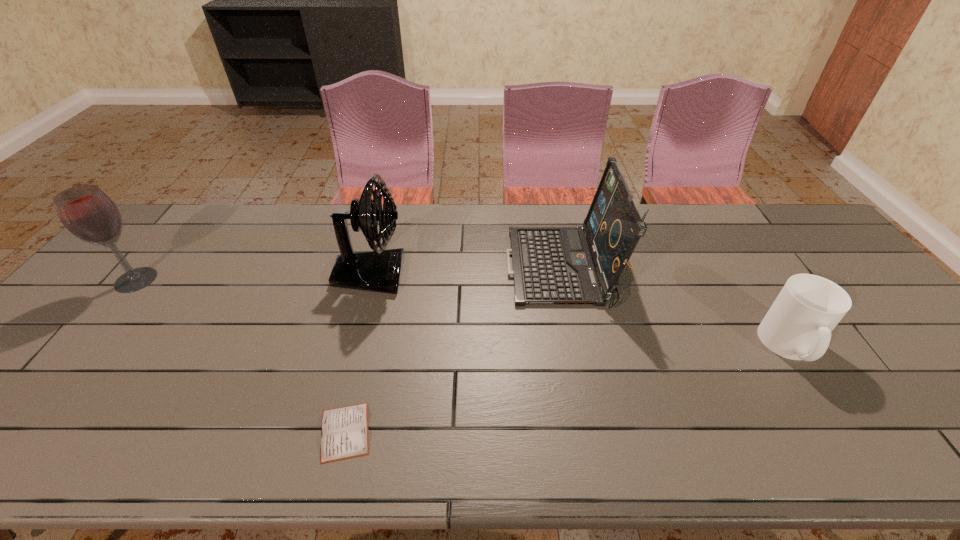
Identify the location of vacant area that satisfies the following two spatial constraints: 1. in front of the fan to blow air; 2. on the back side of the shortest object. (329, 432).

Locate an element on the screen. free region that satisfies the following two spatial constraints: 1. in front of the diary to blow air; 2. on the right side of the fan is located at coordinates (329, 432).